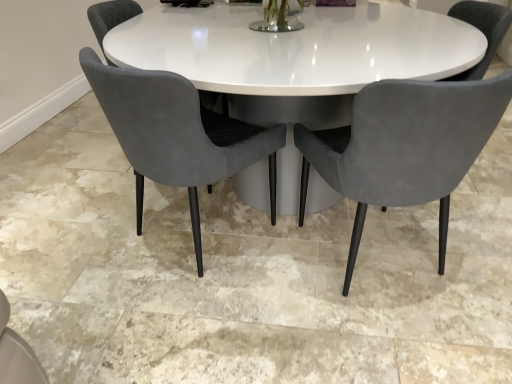
You are a GUI agent. You are given a task and a screenshot of the screen. Output one action in this format:
    pyautogui.click(x=<x>, y=<y>)
    Task: Click on the vacant space underneath velvet grey chair at center, which ranks as the second chair in right-to-left order (from a real-world perspective)
    
    Given the screenshot: What is the action you would take?
    pyautogui.click(x=189, y=241)